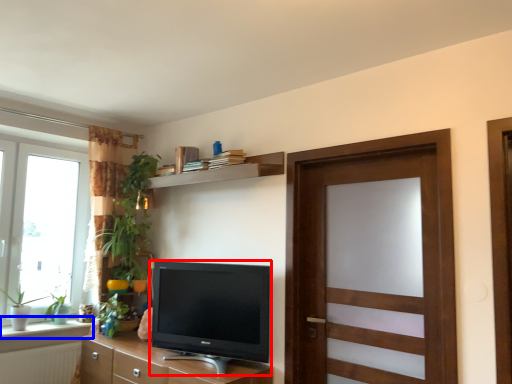
Question: Which point is further to the camera, television (highlighted by a red box) or window sill (highlighted by a blue box)?

Choices:
 (A) television
 (B) window sill

Answer: (B)